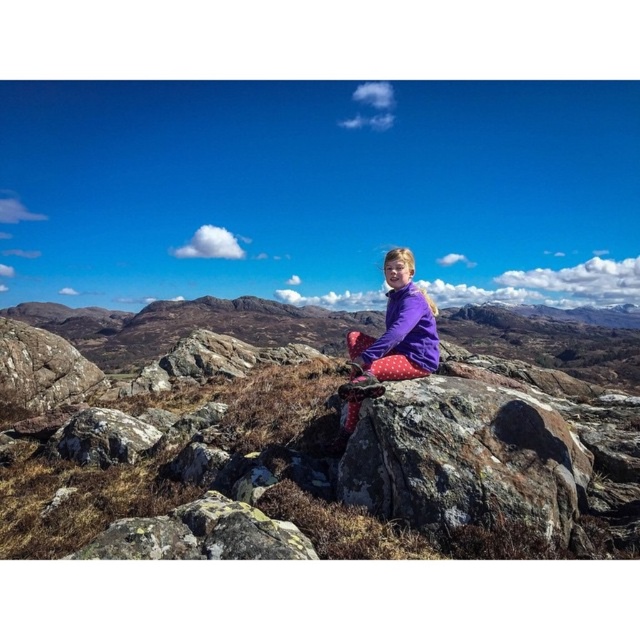
Question: Where is rough textured rock at center located in relation to rough textured rock at left in the image?

Choices:
 (A) right
 (B) left

Answer: (A)

Question: Estimate the real-world distances between objects in this image. Which object is farther from the purple fleece jacket at center?

Choices:
 (A) rough gray rock at center
 (B) rough textured rock at left

Answer: (B)

Question: Is the position of purple fleece jacket at center more distant than that of rough gray rock at center?

Choices:
 (A) no
 (B) yes

Answer: (A)

Question: Which point appears closest to the camera in this image?

Choices:
 (A) (476, 524)
 (B) (452, 470)
 (C) (352, 416)
 (D) (20, 392)

Answer: (A)

Question: Is rough textured rock at center above rough gray rock at center?

Choices:
 (A) no
 (B) yes

Answer: (B)

Question: Among these objects, which one is nearest to the camera?

Choices:
 (A) rough textured rock at center
 (B) rough textured rock at left

Answer: (A)